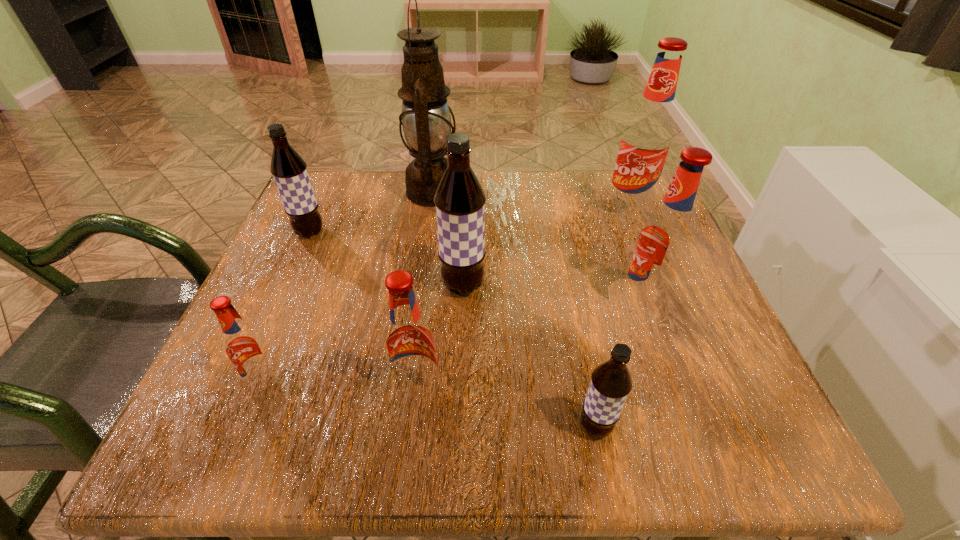
Find the location of a particular element. Image resolution: width=960 pixels, height=540 pixels. free spot between the tallest root beer and the biggest brown root beer is located at coordinates (545, 248).

You are a GUI agent. You are given a task and a screenshot of the screen. Output one action in this format:
    pyautogui.click(x=<x>, y=<y>)
    Task: Click on the vacant area that lies between the brown oil lamp and the second red root beer from left to right
    The width and height of the screenshot is (960, 540).
    Given the screenshot: What is the action you would take?
    pyautogui.click(x=426, y=292)

The height and width of the screenshot is (540, 960). I want to click on vacant area that lies between the third red root beer from right to left and the farthest red root beer, so click(x=523, y=301).

Find the location of `free space between the nearest brown root beer and the smallest red root beer`. free space between the nearest brown root beer and the smallest red root beer is located at coordinates (430, 404).

Find the location of a particular element. free spot between the second farthest brown root beer and the third biggest red root beer is located at coordinates (441, 339).

Locate an element on the screen. Image resolution: width=960 pixels, height=540 pixels. vacant space that's between the smallest red root beer and the third smallest red root beer is located at coordinates (454, 341).

The image size is (960, 540). What are the coordinates of `free space between the second smallest red root beer and the third smallest red root beer` in the screenshot? It's located at (531, 347).

Identify the location of the second closest object relative to the smallest brown root beer. (409, 343).

Locate an element on the screen. The height and width of the screenshot is (540, 960). object that is the closest to the oil lamp is located at coordinates (289, 170).

The image size is (960, 540). I want to click on root beer that is the third closest one to the second farthest red root beer, so (459, 200).